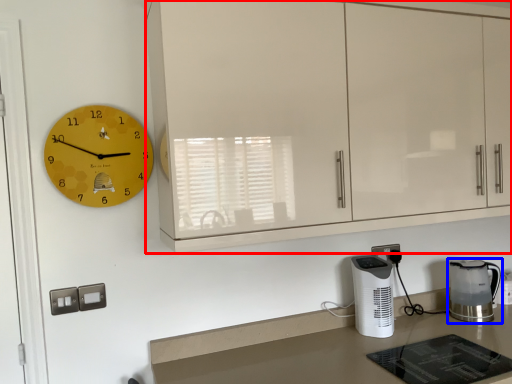
Question: Which of the following is the closest to the observer, cabinetry (highlighted by a red box) or home appliance (highlighted by a blue box)?

Choices:
 (A) cabinetry
 (B) home appliance

Answer: (A)